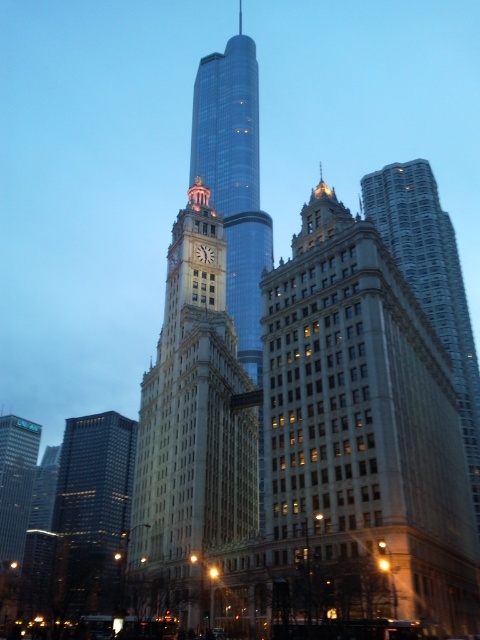
You are standing at the coordinates point 0.5, 0.5 in the cityscape. You want to walk towards the beige stone building at center. In which direction should you move?

Since the beige stone building at center is located at point [363,426], you should move northeast to reach it from your current position at [240,320].

You are standing in the city square and want to take a photo of both the shiny glass skyscraper at center and the dark glass skyscraper at left. Which skyscraper should you position yourself closer to in order to capture both in the same frame?

You should position yourself closer to the shiny glass skyscraper at center because it is closer to you than the dark glass skyscraper at left, so by moving nearer to it, both skyscrapers will be within your camera frame.

Based on the scene description, what is the color and material of the building located at the coordinates point (363, 426)?

The beige stone building at center is located at point (363, 426).